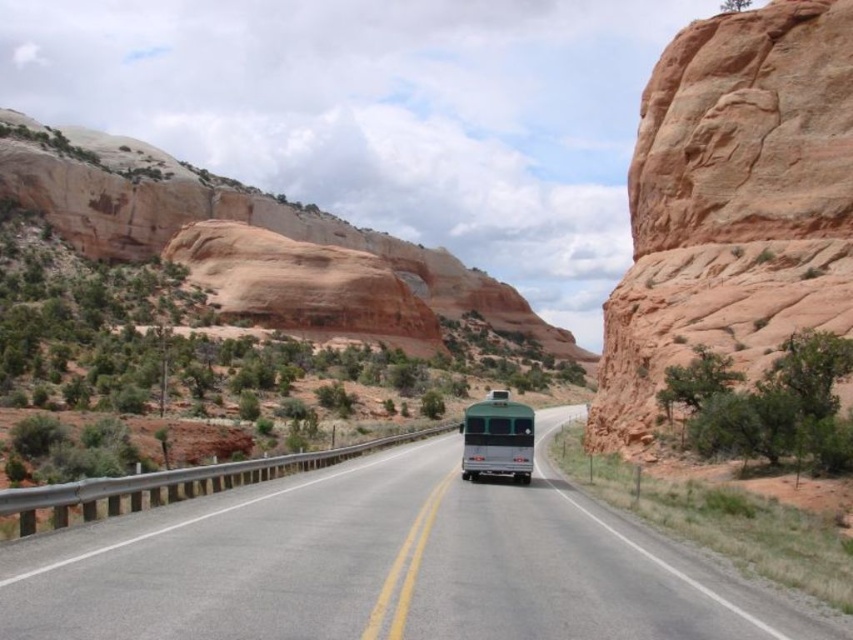
You are a passenger in the green metallic bus at center driving towards the rustic sandstone cliff at right. From your current position, which object is closer to you?

The green metallic bus at center is closer to you than the rustic sandstone cliff at right, so the bus is closer.

You are a photographer positioned at the center of the road. You want to capture the rustic sandstone cliff at right in your shot. Based on its coordinates, is the cliff positioned to the left or right of the center of the image?

The rustic sandstone cliff at right is located at point 0.320 on the x axis and 0.859 on the y axis. Since the x coordinate is less than 0.5, it is positioned to the left of the center.

You are driving a car and see the green and white bus on the road. There are two points marked on your GPS navigation screen at coordinates point (289, 627) and point (328, 243). According to the image, which point is closer to the bus?

Point (289, 627) is in front of point (328, 243), so the point closer to the bus is point (289, 627).